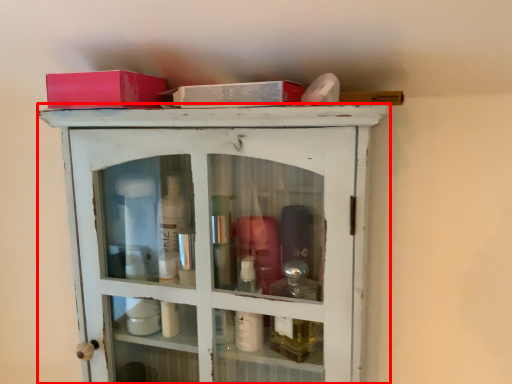
Question: From the image's perspective, where is cupboard (annotated by the red box) located in relation to box in the image?

Choices:
 (A) below
 (B) above

Answer: (A)